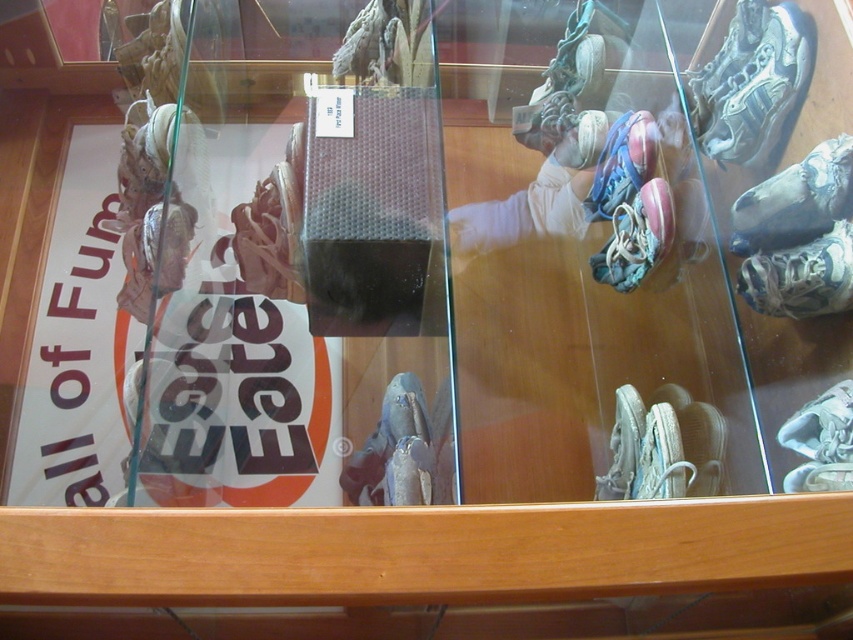
Question: Which object is the closest to the white fabric sneaker at right?

Choices:
 (A) white mesh sneaker at upper right
 (B) white paper at left
 (C) white leather shoe at center

Answer: (C)

Question: Among these objects, which one is nearest to the camera?

Choices:
 (A) blue suede sneaker at center
 (B) white mesh sneaker at upper right
 (C) white fabric sneaker at right
 (D) white matte sneaker at lower center

Answer: (C)

Question: Among these points, which one is farthest from the camera?

Choices:
 (A) (73, 330)
 (B) (788, 8)

Answer: (A)

Question: Is the position of shiny metallic sneaker at upper right more distant than that of white matte sneaker at lower center?

Choices:
 (A) no
 (B) yes

Answer: (A)

Question: Is white paper at left to the right of white matte sneaker at lower center from the viewer's perspective?

Choices:
 (A) no
 (B) yes

Answer: (A)

Question: Can you confirm if white fabric sneaker at right is positioned above blue suede sneaker at center?

Choices:
 (A) no
 (B) yes

Answer: (A)